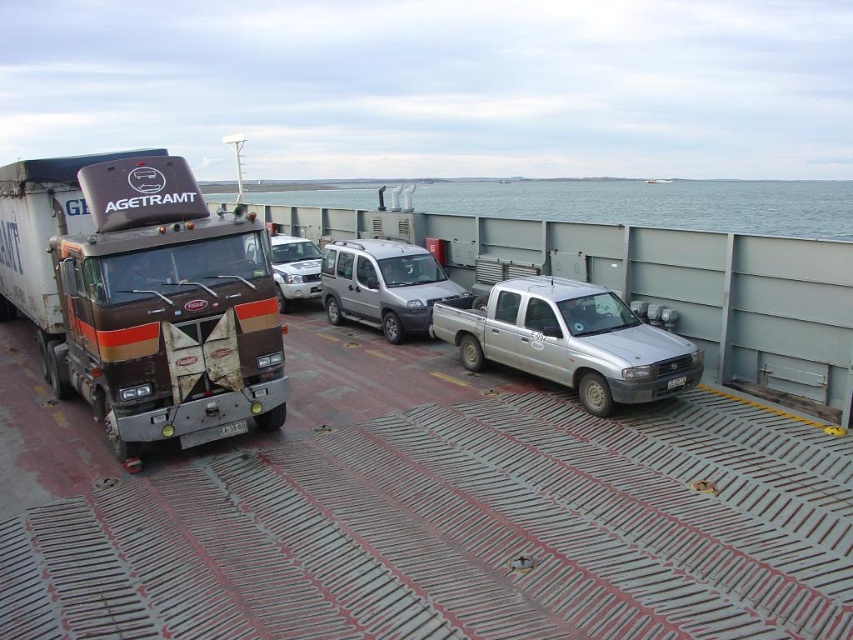
You are a delivery person who needs to load a package onto the silver metallic van at center. The package is too tall to fit through the van doors unless it is tilted. However, the white plastic license plate at center might be in the way. Based on their heights, can you determine if the license plate is an obstacle when tilting the package vertically?

The silver metallic van at center is taller than the white plastic license plate at center. Since the van is taller, the license plate is lower and would not obstruct the vertical tilting of the package.

You are a delivery driver who needs to park your 6.5 meter long truck between the silver metallic van at center and the white plastic license plate at center. Is there enough space between them for your truck?

The silver metallic van at center is 6.61 meters from the white plastic license plate at center, so yes, there is enough space between them for your 6.5 meter long truck.